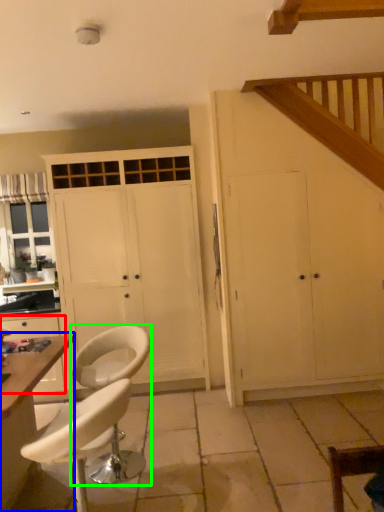
Question: Which is farther away from cabinetry (highlighted by a red box)? table (highlighted by a blue box) or chair (highlighted by a green box)?

Choices:
 (A) table
 (B) chair

Answer: (A)